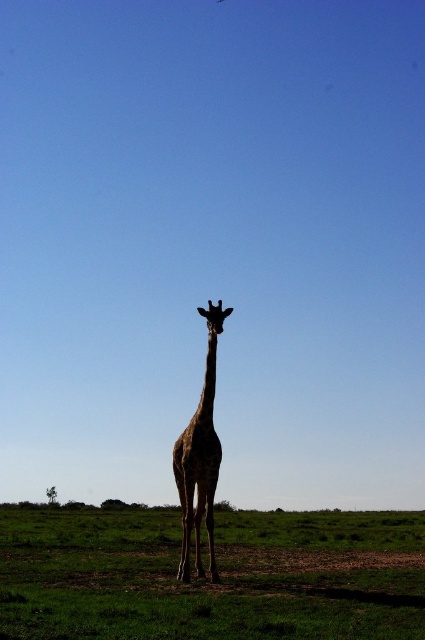
You are a photographer trying to capture the giraffe in the image. You want to place your camera at the point labeled as point (207,580) to ensure the giraffe is centered in the frame. Based on the scene description, what will be the main subject behind the giraffe in this composition?

The point (207,580) corresponds to green grass at center, so the main subject behind the giraffe would be the green grass at center.

You are a photographer trying to capture the spotted fur giraffe at center in your shot. You notice the green grass at center is blocking part of the giraffe. Can you adjust your position to avoid the grass while still keeping the giraffe in the frame?

The green grass at center is located below the spotted fur giraffe at center, so you can lower your camera angle slightly to avoid the grass while keeping the giraffe in the frame.